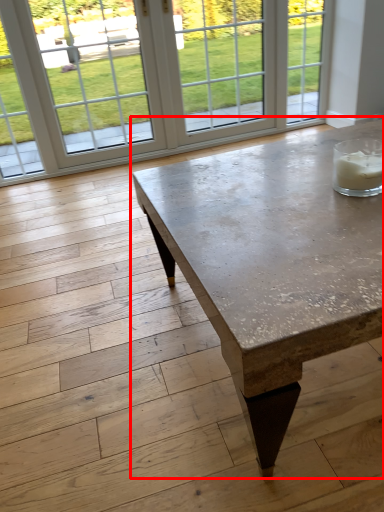
Question: Where is coffee table (annotated by the red box) located in relation to window in the image?

Choices:
 (A) right
 (B) left

Answer: (A)